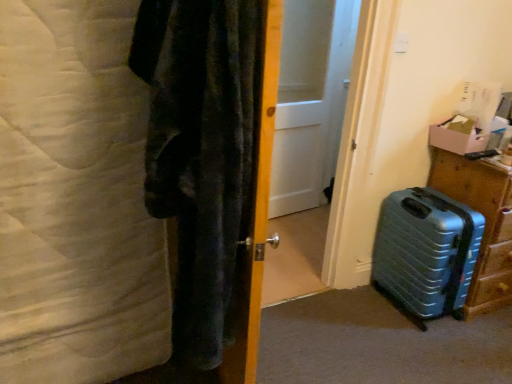
The height and width of the screenshot is (384, 512). In order to click on vacant area that lies to the right of wooden door at center in this screenshot , I will do `click(320, 354)`.